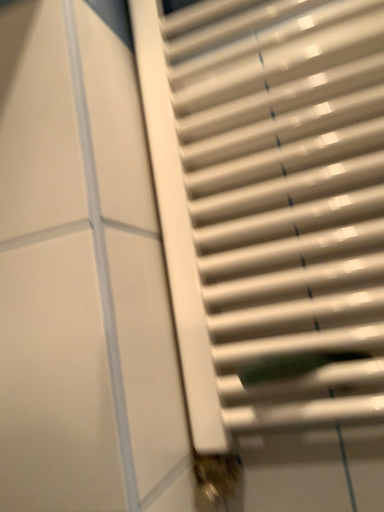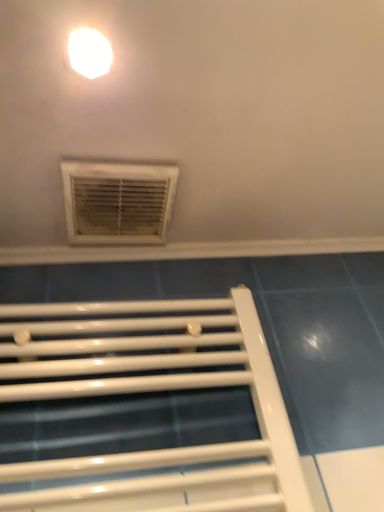
Question: Which way did the camera rotate in the video?

Choices:
 (A) rotated left
 (B) rotated right

Answer: (B)